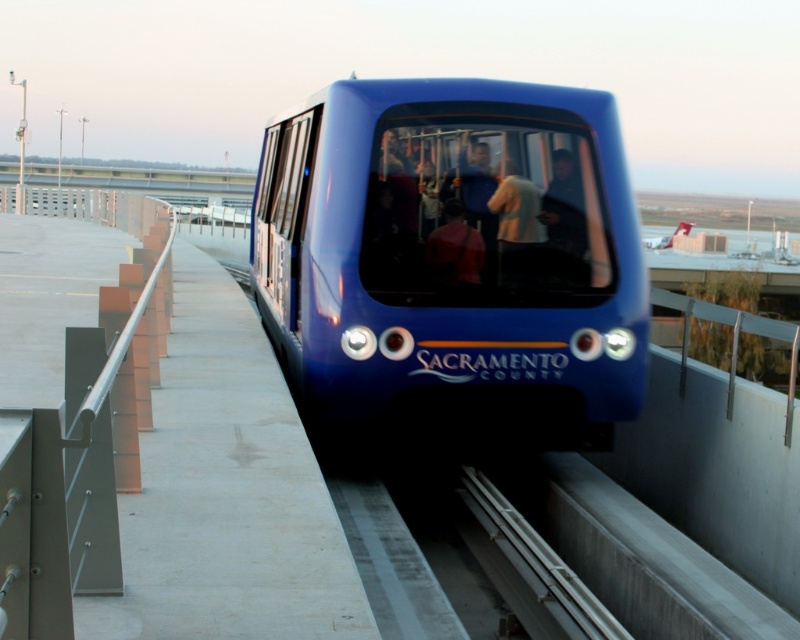
Question: Estimate the real-world distances between objects in this image. Which object is farther from the metal/smooth train track at center?

Choices:
 (A) matte blue train at center
 (B) blue glossy train at center

Answer: (A)

Question: Does blue glossy train at center have a lesser width compared to metal/smooth train track at center?

Choices:
 (A) yes
 (B) no

Answer: (B)

Question: Which object is positioned closest to the metal/smooth train track at center?

Choices:
 (A) matte blue train at center
 (B) blue glossy train at center

Answer: (B)

Question: Does metal/smooth train track at center have a lesser width compared to matte blue train at center?

Choices:
 (A) no
 (B) yes

Answer: (A)

Question: Estimate the real-world distances between objects in this image. Which object is farther from the matte blue train at center?

Choices:
 (A) metal/smooth train track at center
 (B) blue glossy train at center

Answer: (A)

Question: Is the position of metal/smooth train track at center less distant than that of matte blue train at center?

Choices:
 (A) no
 (B) yes

Answer: (B)